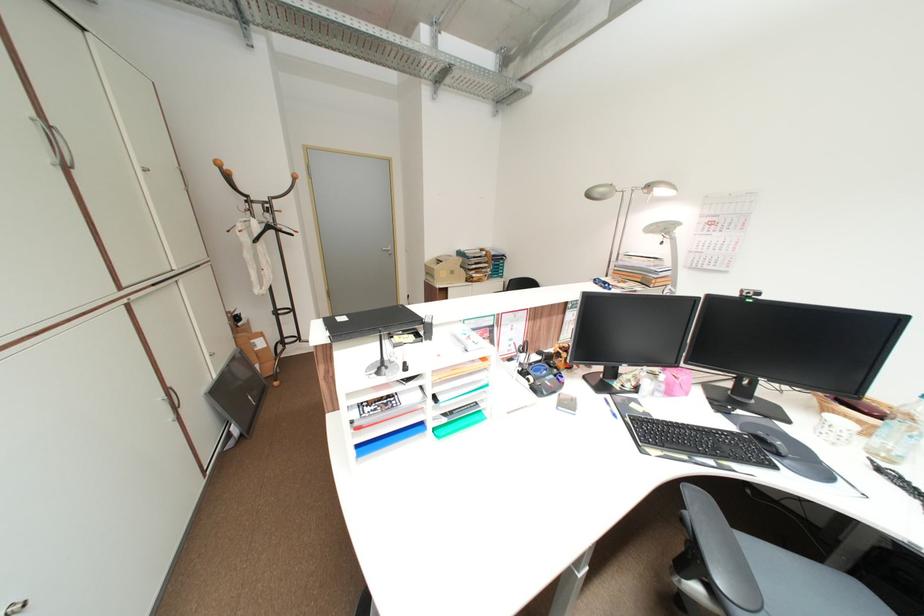
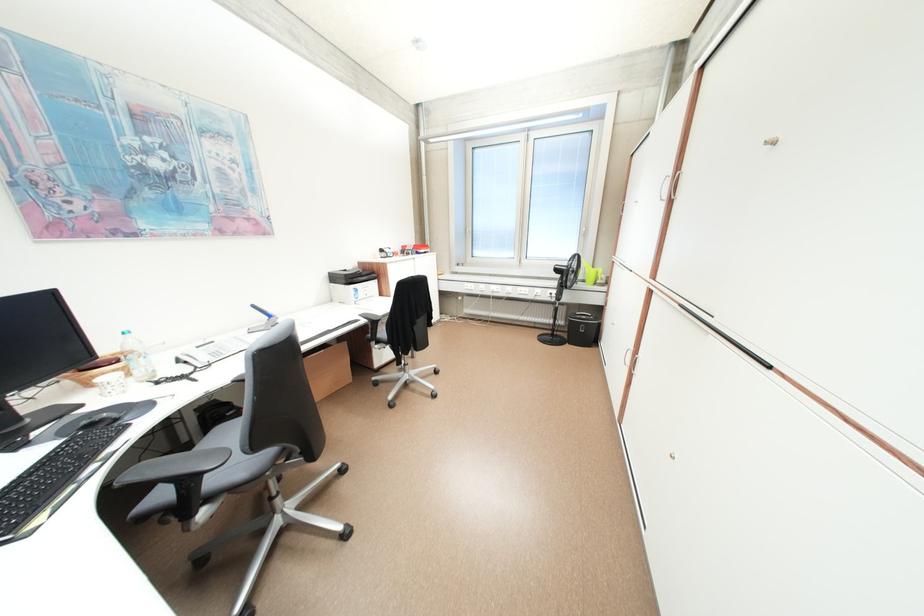
In the second image, find the point that corresponds to the point at 771,440 in the first image.

(101, 426)